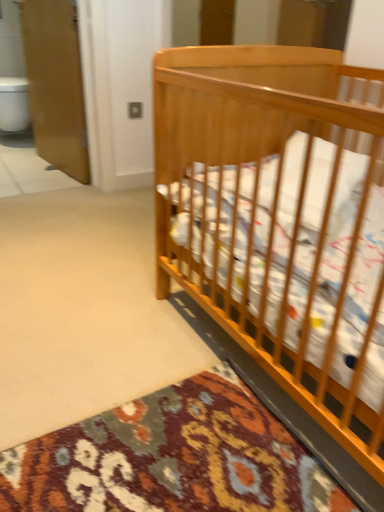
Identify the location of free location to the left of wooden screen door at upper left. (20, 166).